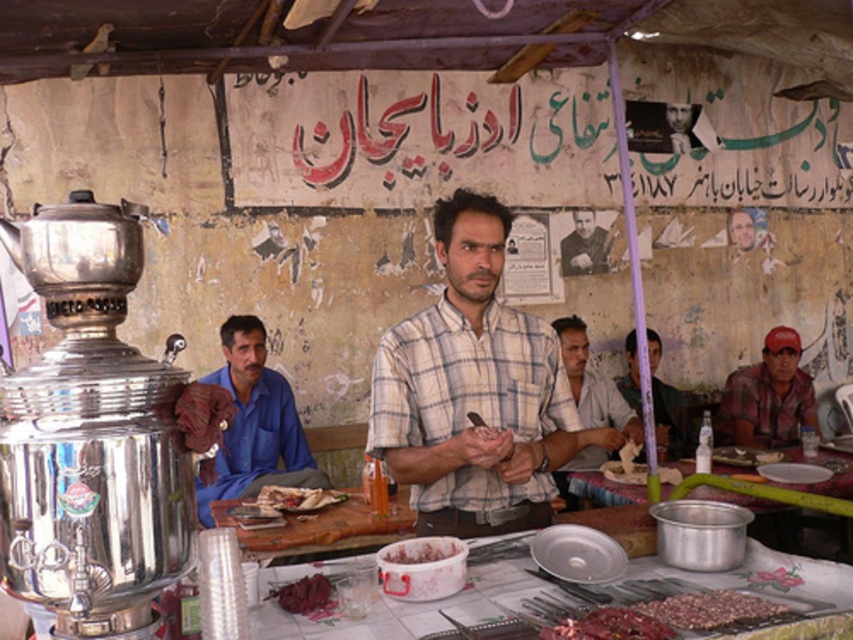
Is plaid shirt at center smaller than meat chunks at center?

Actually, plaid shirt at center might be larger than meat chunks at center.

Consider the image. Can you confirm if plaid shirt at center is taller than meat chunks at center?

Correct, plaid shirt at center is much taller as meat chunks at center.

Between point (782, 365) and point (671, 596), which one is positioned in front?

Point (671, 596) is in front.

The height and width of the screenshot is (640, 853). I want to click on plaid shirt at center, so click(769, 396).

Is the position of dark brown meat at center more distant than that of smooth skin man at center?

That is False.

Who is positioned more to the right, dark brown meat at center or smooth skin man at center?

smooth skin man at center

Which is in front, point (581, 634) or point (579, 230)?

Point (581, 634) is more forward.

Where is `dark brown meat at center`? This screenshot has width=853, height=640. dark brown meat at center is located at coordinates [608, 625].

Does white checkered shirt at center lie behind dark brown meat at center?

Yes.

Can you confirm if white checkered shirt at center is thinner than dark brown meat at center?

In fact, white checkered shirt at center might be wider than dark brown meat at center.

What are the coordinates of `white checkered shirt at center` in the screenshot? It's located at (473, 390).